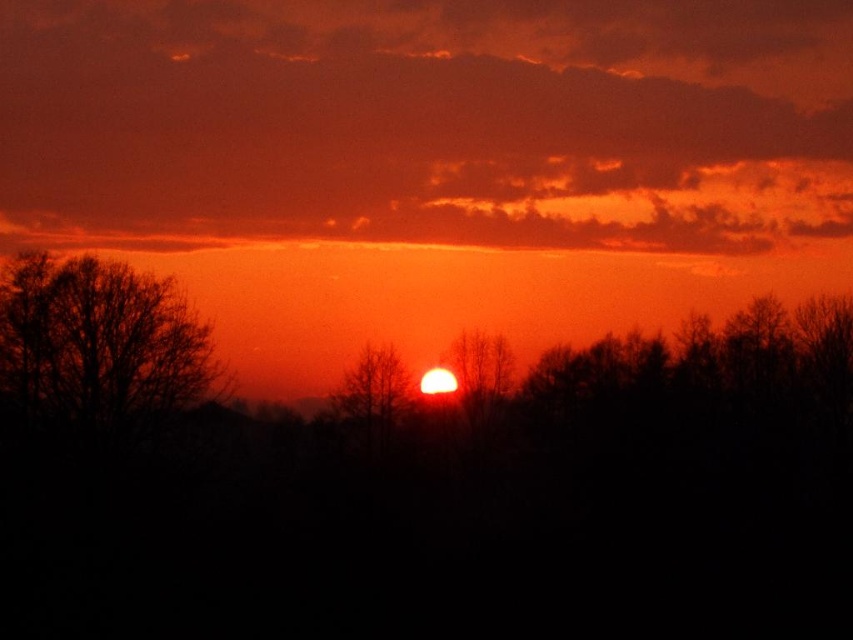
What do you see at coordinates (427, 122) in the screenshot? The image size is (853, 640). I see `matte orange cloud at upper center` at bounding box center [427, 122].

Does point (254, 8) come in front of point (386, 424)?

No.

The image size is (853, 640). In order to click on matte orange cloud at upper center in this screenshot , I will do `click(427, 122)`.

Which of these two, matte orange cloud at upper center or silhouette bare tree at center, stands shorter?

silhouette bare tree at center

Which is more to the left, matte orange cloud at upper center or silhouette bare tree at center?

Positioned to the left is matte orange cloud at upper center.

From the picture: Who is more distant from viewer, (735,172) or (482,403)?

The point (735,172) is behind.

At what (x,y) coordinates should I click in order to perform the action: click on matte orange cloud at upper center. Please return your answer as a coordinate pair (x, y). This screenshot has height=640, width=853. Looking at the image, I should click on (427, 122).

Looking at this image, between silhouette tree at center and silhouette bare tree at center, which one is positioned lower?

silhouette tree at center is lower down.

Can you confirm if silhouette tree at center is positioned above silhouette bare tree at center?

No.

Measure the distance between silhouette tree at center and camera.

silhouette tree at center and camera are 232.54 feet apart.

This screenshot has width=853, height=640. I want to click on silhouette tree at center, so click(x=373, y=390).